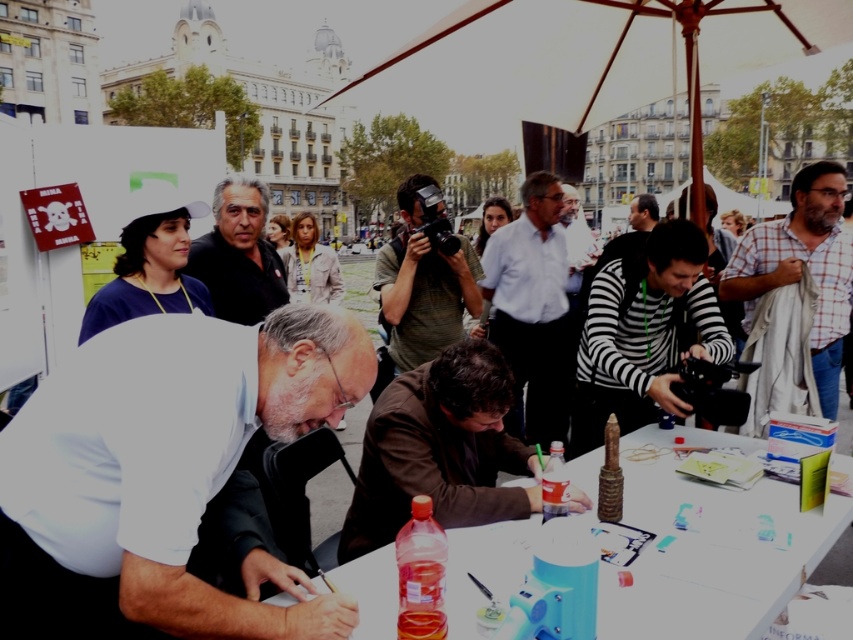
Question: Does white matte shirt at center have a greater width compared to white shirt at center?

Choices:
 (A) no
 (B) yes

Answer: (B)

Question: Which of the following is the closest to the observer?

Choices:
 (A) matte black shirt at center
 (B) striped fabric camera at center

Answer: (A)

Question: Which object is farther from the camera taking this photo?

Choices:
 (A) white checkered shirt at right
 (B) white matte shirt at center
 (C) white shirt at center
 (D) white plastic table at center

Answer: (C)

Question: Can you confirm if white plastic table at center is smaller than matte black shirt at center?

Choices:
 (A) yes
 (B) no

Answer: (B)

Question: Where is white plastic table at center located in relation to white shirt at center in the image?

Choices:
 (A) above
 (B) below

Answer: (B)

Question: Which object appears farthest from the camera in this image?

Choices:
 (A) white shirt at center
 (B) white plastic table at center
 (C) matte black shirt at center
 (D) striped fabric camera at center

Answer: (D)